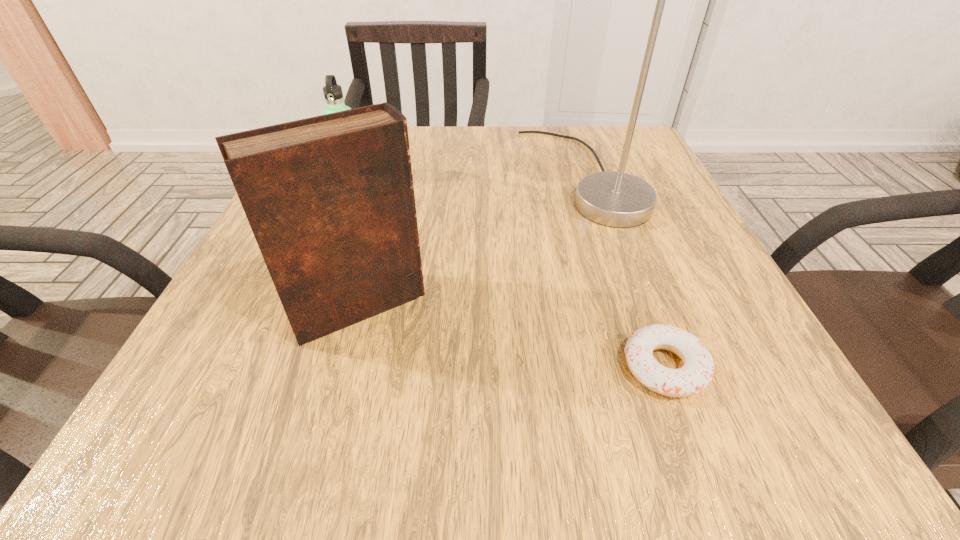
You are a GUI agent. You are given a task and a screenshot of the screen. Output one action in this format:
    pyautogui.click(x=<x>, y=<y>)
    Task: Click on the table lamp
    This screenshot has width=960, height=540.
    Given the screenshot: What is the action you would take?
    pyautogui.click(x=613, y=199)

In order to click on Bible in this screenshot , I will do `click(330, 200)`.

Find the location of a particular element. thermos bottle is located at coordinates (333, 94).

I want to click on doughnut, so click(x=698, y=370).

Identify the location of free space located 0.310m on the front of the table lamp. This screenshot has width=960, height=540. (658, 388).

Identify the location of vacant space located on the front of the second tallest object. (329, 415).

Image resolution: width=960 pixels, height=540 pixels. I want to click on free location located on the right of the thermos bottle, so click(465, 176).

Identify the location of free region located 0.180m on the left of the doughnut. Image resolution: width=960 pixels, height=540 pixels. (483, 367).

You are a GUI agent. You are given a task and a screenshot of the screen. Output one action in this format:
    pyautogui.click(x=<x>, y=<y>)
    Task: Click on the table lamp at the far edge
    Image resolution: width=960 pixels, height=540 pixels.
    Given the screenshot: What is the action you would take?
    pyautogui.click(x=613, y=199)

This screenshot has width=960, height=540. I want to click on thermos bottle located at the far edge, so click(x=333, y=94).